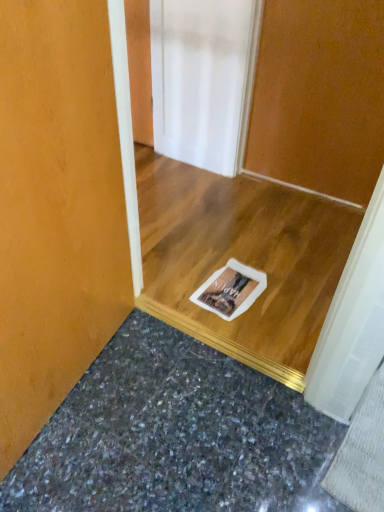
Question: Considering the positions of granite at lower center and wooden door at center in the image, is granite at lower center wider or thinner than wooden door at center?

Choices:
 (A) thin
 (B) wide

Answer: (B)

Question: Does point (319, 510) appear closer or farther from the camera than point (339, 185)?

Choices:
 (A) farther
 (B) closer

Answer: (B)

Question: In the image, is granite at lower center positioned in front of or behind wooden door at center?

Choices:
 (A) front
 (B) behind

Answer: (A)

Question: Is wooden door at center bigger or smaller than granite at lower center?

Choices:
 (A) small
 (B) big

Answer: (B)

Question: Considering the positions of wooden door at center and granite at lower center in the image, is wooden door at center taller or shorter than granite at lower center?

Choices:
 (A) short
 (B) tall

Answer: (B)

Question: Is point (336, 31) closer or farther from the camera than point (289, 426)?

Choices:
 (A) closer
 (B) farther

Answer: (B)

Question: In the image, is wooden door at center on the left side or the right side of granite at lower center?

Choices:
 (A) right
 (B) left

Answer: (A)